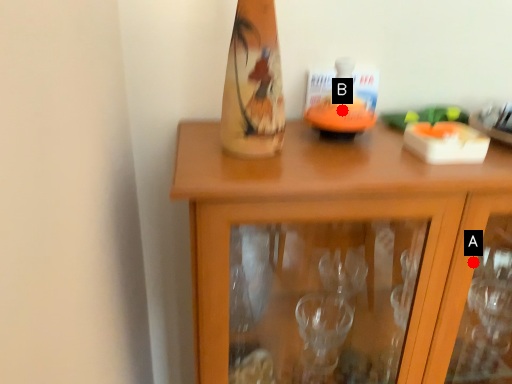
Question: Two points are circled on the image, labeled by A and B beside each circle. Which point is closer to the camera taking this photo?

Choices:
 (A) A is closer
 (B) B is closer

Answer: (A)